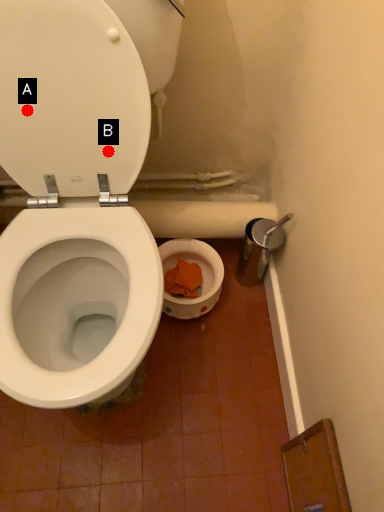
Question: Two points are circled on the image, labeled by A and B beside each circle. Which point is farther to the camera?

Choices:
 (A) A is further
 (B) B is further

Answer: (B)